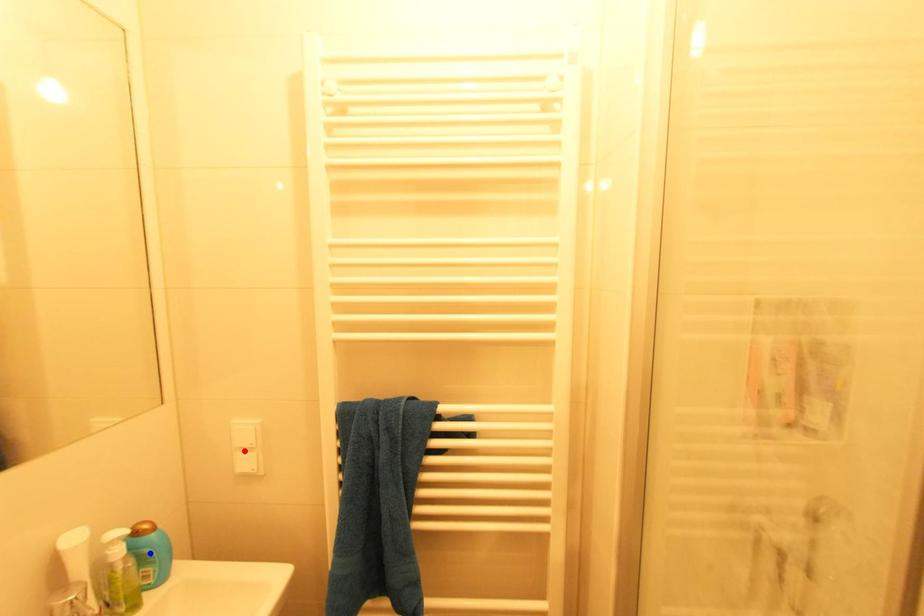
Question: Which of the two points in the image is closer to the camera?

Choices:
 (A) Blue point is closer.
 (B) Red point is closer.

Answer: (A)